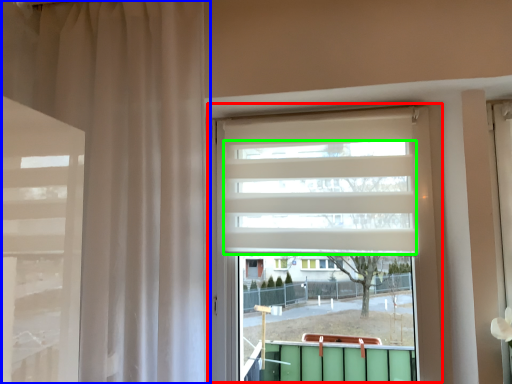
Question: Which object is the closest to the window (highlighted by a red box)? Choose among these: curtain (highlighted by a blue box) or blind (highlighted by a green box).

Choices:
 (A) curtain
 (B) blind

Answer: (B)